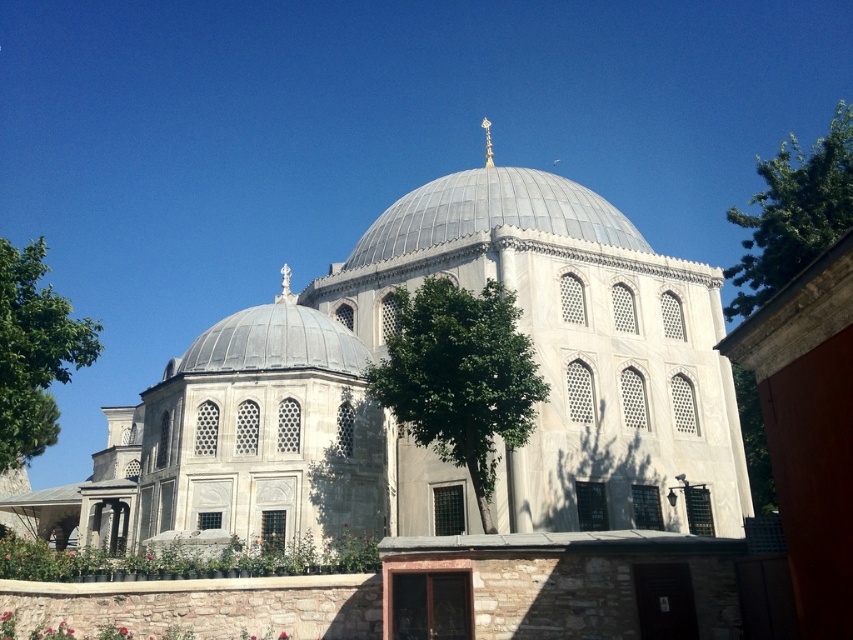
Question: Does white stone dome at center have a larger size compared to gray metallic dome at center?

Choices:
 (A) no
 (B) yes

Answer: (B)

Question: Is green leafy tree at center thinner than gray metallic dome at center?

Choices:
 (A) no
 (B) yes

Answer: (B)

Question: Which point is closer to the camera taking this photo?

Choices:
 (A) (68, 333)
 (B) (236, 352)
 (C) (592, 392)

Answer: (A)

Question: Which object is farther from the camera taking this photo?

Choices:
 (A) gray stone dome at center
 (B) gray metallic dome at center
 (C) green leafy tree at center

Answer: (B)

Question: Is white stone dome at center above gray stone dome at center?

Choices:
 (A) yes
 (B) no

Answer: (A)

Question: Estimate the real-world distances between objects in this image. Which object is closer to the gray metallic dome at center?

Choices:
 (A) green leafy tree at upper right
 (B) gray stone dome at center
 (C) green leafy tree at left
 (D) green leafy tree at center

Answer: (D)